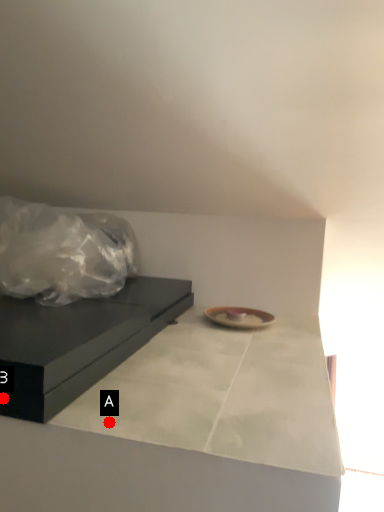
Question: Two points are circled on the image, labeled by A and B beside each circle. Which of the following is the closest to the observer?

Choices:
 (A) A is closer
 (B) B is closer

Answer: (A)